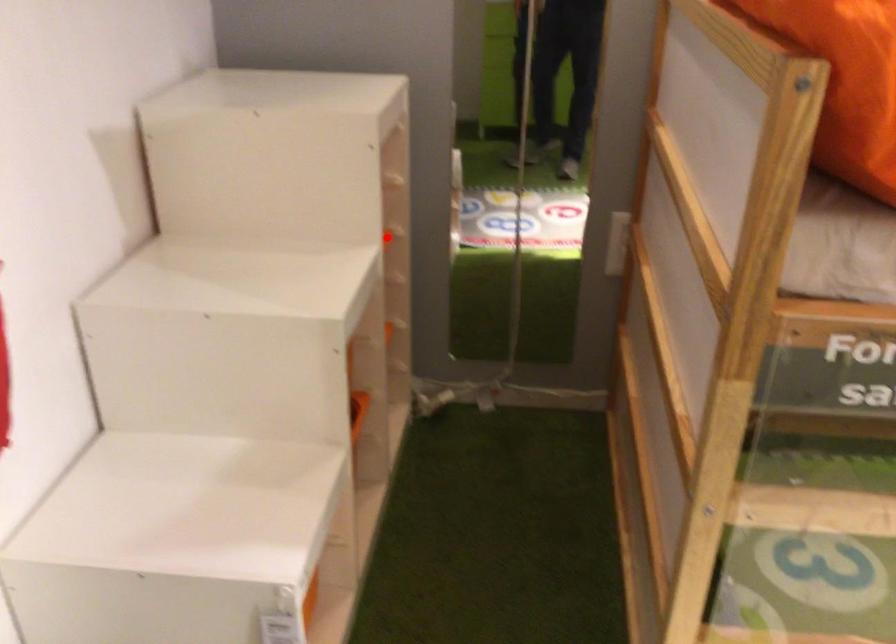
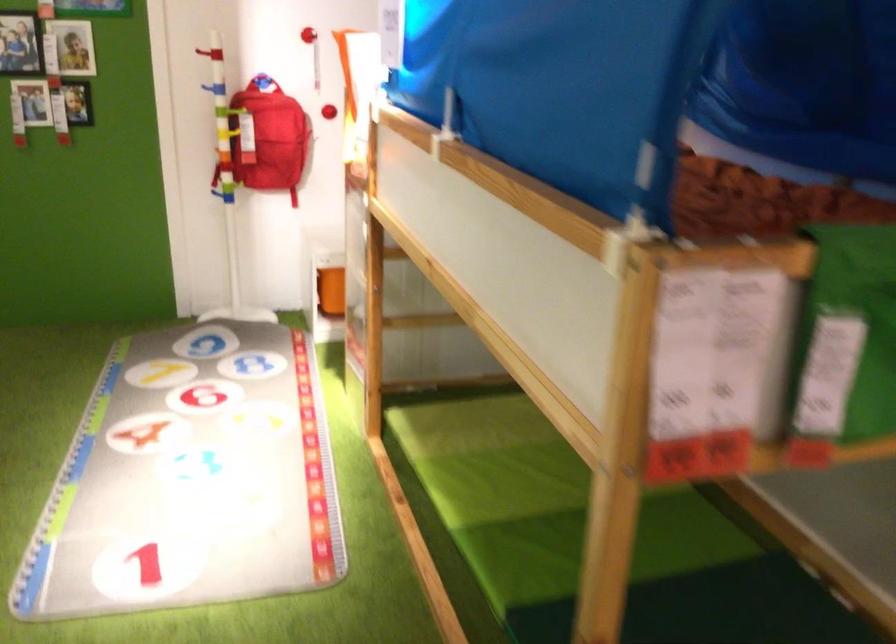
Question: I am providing you with two images of the same scene from different viewpoints. A red point is marked on the first image. Can you still see the location of the red point in image 2?

Choices:
 (A) Yes
 (B) No

Answer: (B)